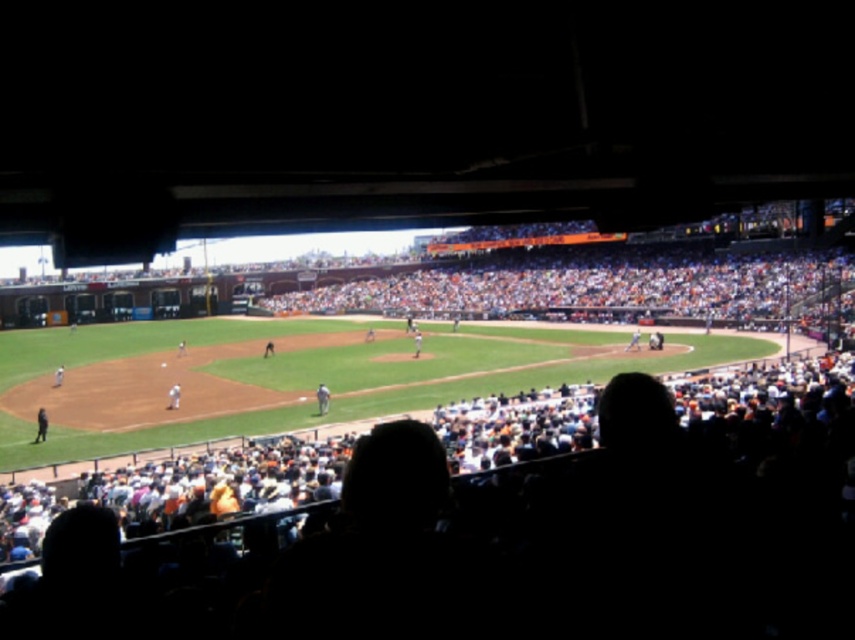
Question: Which of these objects is positioned farthest from the white fabric uniform at center?

Choices:
 (A) white uniformed player at center
 (B) white uniform at center
 (C) dark blue uniform at lower left

Answer: (B)

Question: Which object appears farthest from the camera in this image?

Choices:
 (A) white fabric uniform at center
 (B) white uniform at center
 (C) dark blue uniform at lower left
 (D) white uniformed player at center

Answer: (B)

Question: Is white fabric uniform at center below white uniform at center?

Choices:
 (A) no
 (B) yes

Answer: (B)

Question: Is white uniformed player at center smaller than dark blue uniform at lower left?

Choices:
 (A) yes
 (B) no

Answer: (A)

Question: Which object is positioned farthest from the dark blue uniform at lower left?

Choices:
 (A) white uniform at center
 (B) white fabric uniform at center

Answer: (A)

Question: Does dark blue uniform at lower left appear over white fabric uniform at center?

Choices:
 (A) yes
 (B) no

Answer: (B)